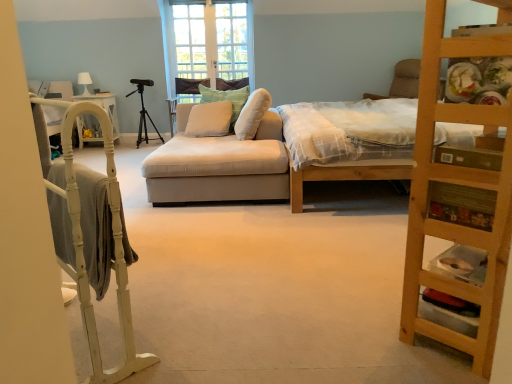
In order to click on free space in front of beige fabric couch at center in this screenshot , I will do `click(225, 236)`.